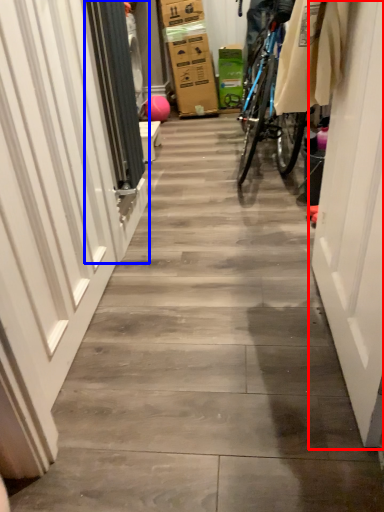
Question: Which object appears farthest to the camera in this image, door (highlighted by a red box) or screen door (highlighted by a blue box)?

Choices:
 (A) door
 (B) screen door

Answer: (B)